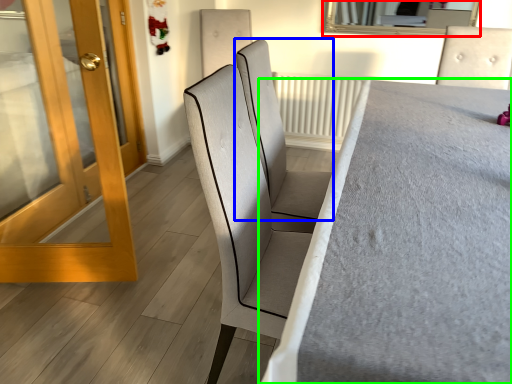
Question: Estimate the real-world distances between objects in this image. Which object is closer to mirror (highlighted by a red box), chair (highlighted by a blue box) or furniture (highlighted by a green box)?

Choices:
 (A) chair
 (B) furniture

Answer: (B)